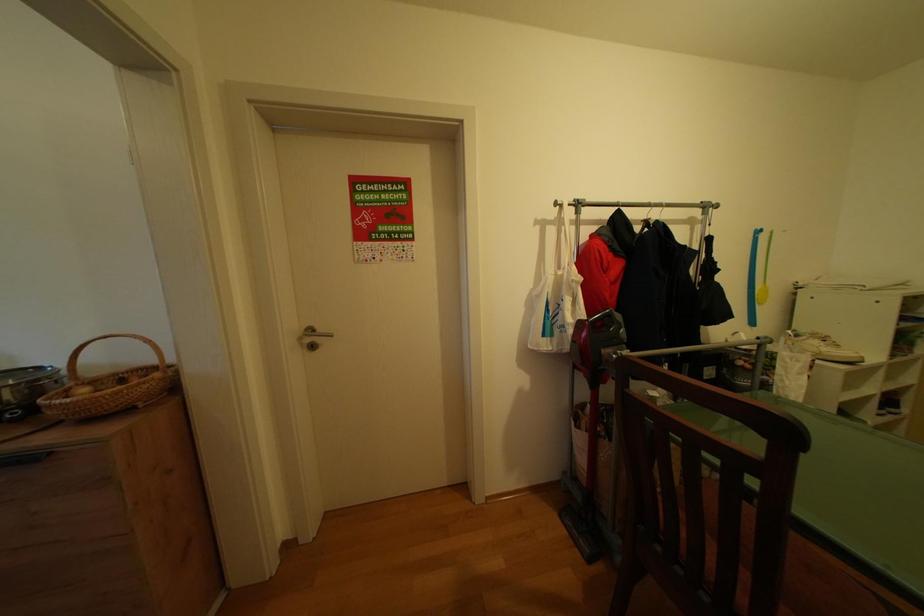
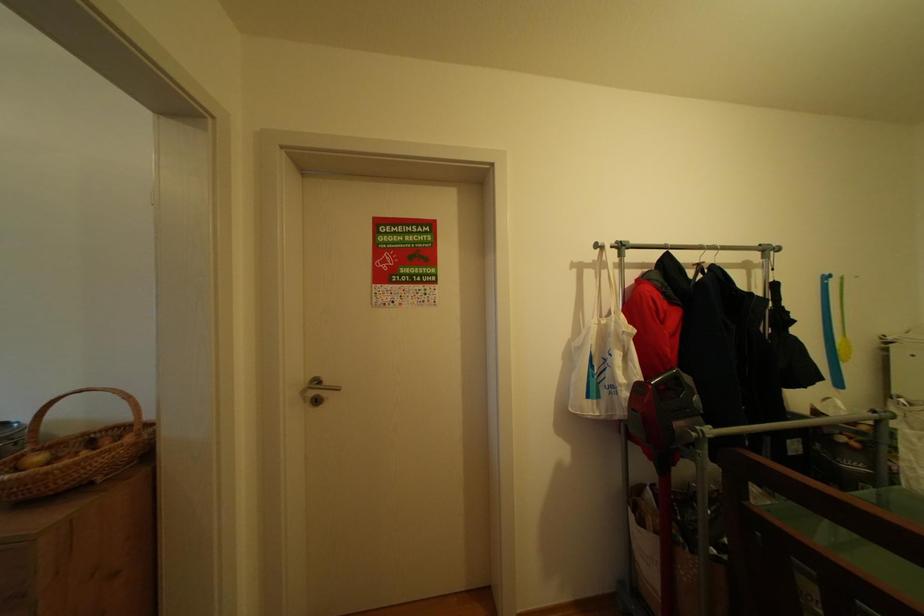
What movement of the cameraman would produce the second image?

The cameraman moved toward left, forward.